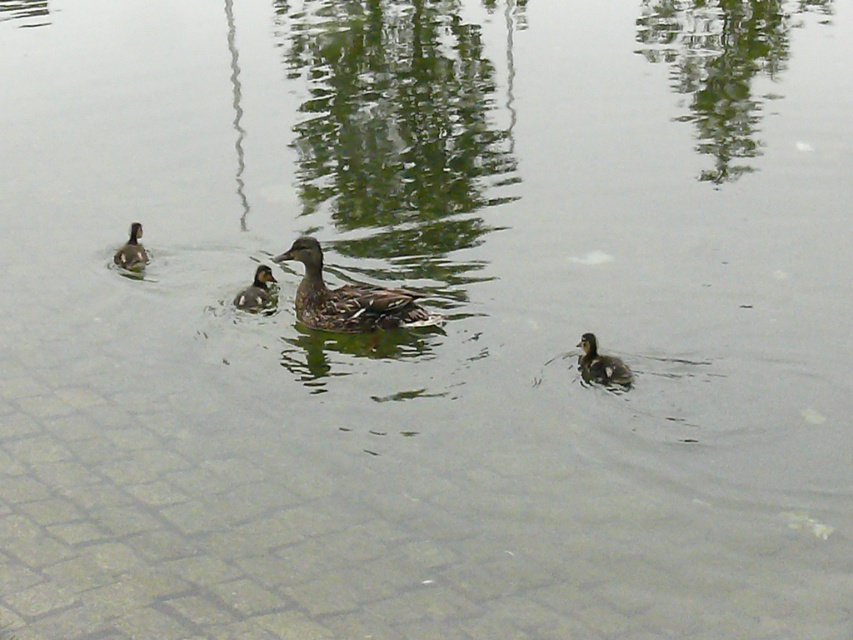
Question: Which point is farther from the camera taking this photo?

Choices:
 (A) (260, 289)
 (B) (138, 244)
 (C) (625, 381)

Answer: (B)

Question: Estimate the real-world distances between objects in this image. Which object is closer to the brown matte duckling at center?

Choices:
 (A) brown matte duckling at left
 (B) brown speckled duckling at center

Answer: (B)

Question: Is brown speckled duckling at center wider than brown matte duckling at center?

Choices:
 (A) yes
 (B) no

Answer: (A)

Question: Does brown fuzzy duckling at right have a smaller size compared to brown matte duckling at center?

Choices:
 (A) no
 (B) yes

Answer: (B)

Question: Can you confirm if brown fuzzy duckling at right is wider than brown matte duckling at left?

Choices:
 (A) no
 (B) yes

Answer: (A)

Question: Estimate the real-world distances between objects in this image. Which object is closer to the brown speckled duckling at center?

Choices:
 (A) brown fuzzy duckling at right
 (B) brown matte duckling at center

Answer: (B)